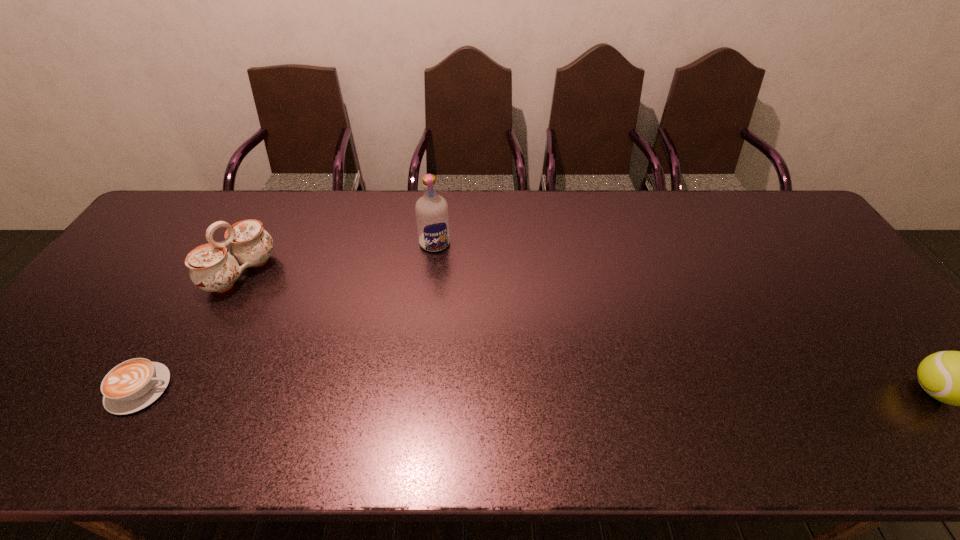
At what (x,y) coordinates should I click in order to perform the action: click on the shortest object. Please return your answer as a coordinate pair (x, y). This screenshot has width=960, height=540. Looking at the image, I should click on (134, 384).

Where is `chinaware`? This screenshot has width=960, height=540. chinaware is located at coordinates (211, 268).

Locate an element on the screen. This screenshot has width=960, height=540. vodka is located at coordinates (431, 210).

You are a GUI agent. You are given a task and a screenshot of the screen. Output one action in this format:
    pyautogui.click(x=<x>, y=<y>)
    Task: Click on the tallest object
    
    Given the screenshot: What is the action you would take?
    pyautogui.click(x=431, y=210)

This screenshot has height=540, width=960. I want to click on free space located on the side of the shortest object with the handle, so click(275, 389).

In order to click on free space located by the handle of the third shortest object in this screenshot , I will do `click(330, 327)`.

I want to click on vacant space located 0.350m by the handle of the third shortest object, so click(353, 341).

Identify the location of vacant space positioned by the handle of the third shortest object. (365, 348).

Identify the location of free spot located 0.130m on the label of the vodka. (447, 284).

This screenshot has width=960, height=540. What are the coordinates of `blank space located 0.050m on the label of the vodka` in the screenshot? It's located at (442, 265).